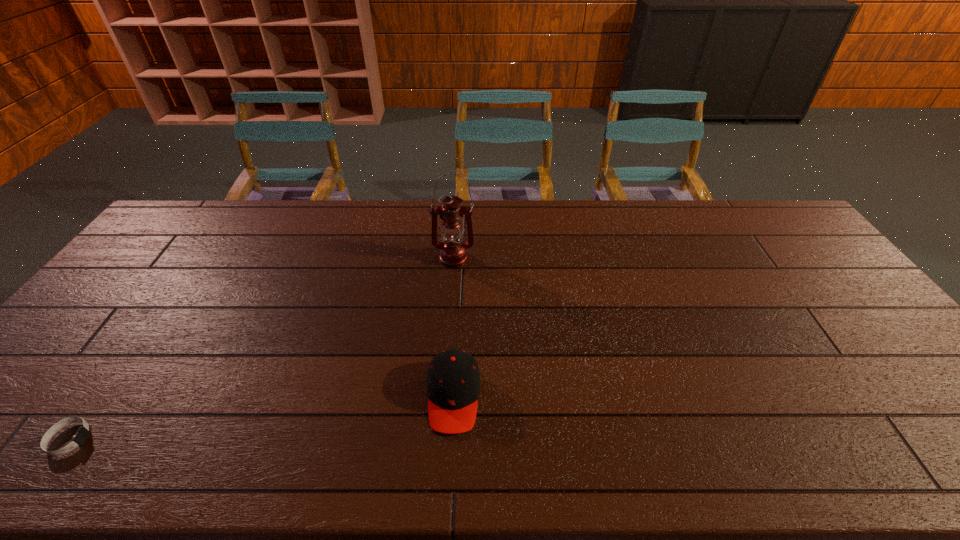
Where is `the tallest object`? the tallest object is located at coordinates (453, 252).

Where is `the farthest object`? the farthest object is located at coordinates (453, 252).

Locate an element on the screen. The image size is (960, 540). the second tallest object is located at coordinates (453, 384).

Find the location of `the shortest object`. the shortest object is located at coordinates (82, 434).

Where is `wristband`? wristband is located at coordinates (82, 434).

This screenshot has width=960, height=540. In order to click on free spot located on the back of the farthest object in this screenshot , I will do `click(455, 224)`.

Where is `vacant space located 0.080m on the front-facing side of the second shortest object`? This screenshot has width=960, height=540. vacant space located 0.080m on the front-facing side of the second shortest object is located at coordinates (449, 472).

The image size is (960, 540). I want to click on free location located on the outer surface of the shortest object, so click(x=231, y=439).

Locate an element on the screen. The height and width of the screenshot is (540, 960). cap positioned at the near edge is located at coordinates (453, 384).

Locate an element on the screen. The image size is (960, 540). wristband located in the near edge section of the desktop is located at coordinates (82, 434).